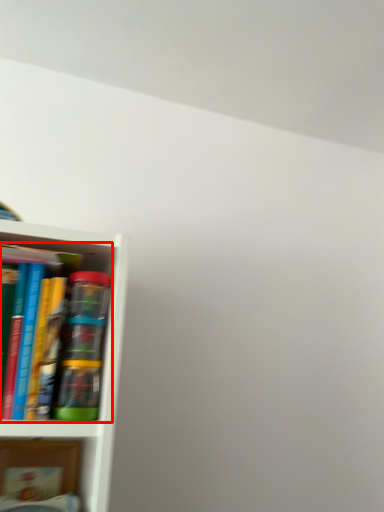
Question: Where is book (annotated by the red box) located in relation to book in the image?

Choices:
 (A) left
 (B) right

Answer: (B)